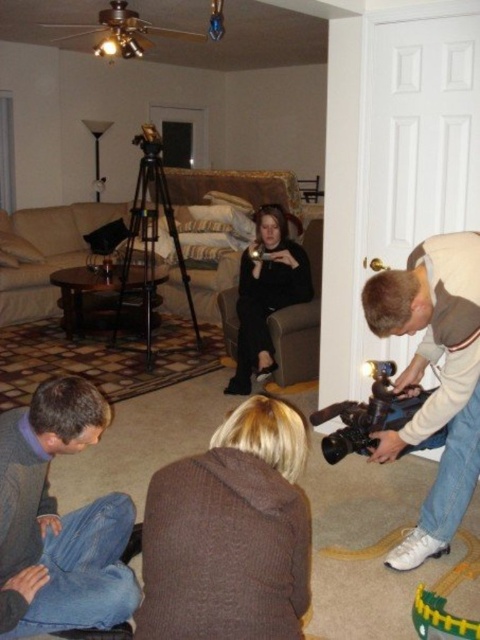
Does black metal tripod at center have a smaller size compared to black matte video camera at lower right?

No, black metal tripod at center is not smaller than black matte video camera at lower right.

Is black metal tripod at center below black matte video camera at lower right?

No, black metal tripod at center is not below black matte video camera at lower right.

Describe the element at coordinates (151, 236) in the screenshot. This screenshot has width=480, height=640. I see `black metal tripod at center` at that location.

At what (x,y) coordinates should I click in order to perform the action: click on black metal tripod at center. Please return your answer as a coordinate pair (x, y). Looking at the image, I should click on (151, 236).

Does blue denim jeans at lower left have a smaller size compared to black matte video camera at lower right?

Incorrect, blue denim jeans at lower left is not smaller in size than black matte video camera at lower right.

Is blue denim jeans at lower left thinner than black matte video camera at lower right?

Indeed, blue denim jeans at lower left has a lesser width compared to black matte video camera at lower right.

Where is `blue denim jeans at lower left`? Image resolution: width=480 pixels, height=640 pixels. blue denim jeans at lower left is located at coordinates (59, 522).

Who is more distant from viewer, (412, 308) or (268, 236)?

The point (268, 236) is behind.

Does white leather camera at lower right lie behind black matte dress at center?

No.

Where is `white leather camera at lower right`? white leather camera at lower right is located at coordinates (440, 378).